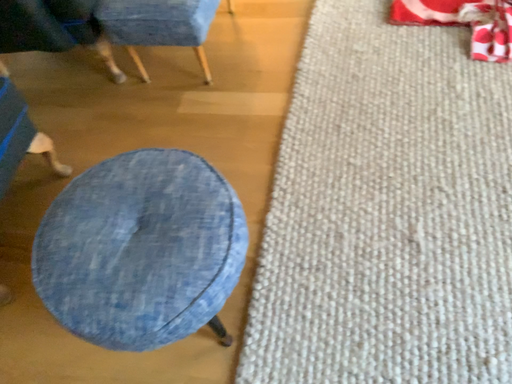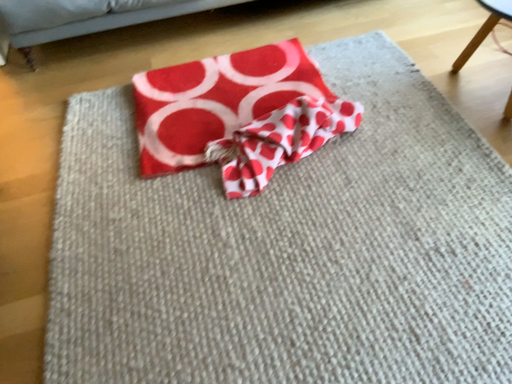
Question: How did the camera likely rotate when shooting the video?

Choices:
 (A) rotated upward
 (B) rotated downward

Answer: (A)